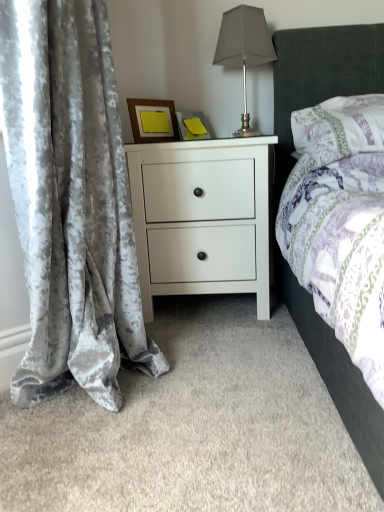
Question: From their relative heights in the image, would you say white matte nightstand at center is taller or shorter than velvet gray curtain at left?

Choices:
 (A) tall
 (B) short

Answer: (B)

Question: Looking at the image, does white matte nightstand at center seem bigger or smaller compared to velvet gray curtain at left?

Choices:
 (A) big
 (B) small

Answer: (B)

Question: Estimate the real-world distances between objects in this image. Which object is farther from the satin silver table lamp at upper right?

Choices:
 (A) white matte nightstand at center
 (B) patterned fabric pillow at upper right
 (C) wooden frame at upper center
 (D) velvet gray curtain at left

Answer: (D)

Question: Which object is positioned closest to the satin silver table lamp at upper right?

Choices:
 (A) wooden frame at upper center
 (B) white matte nightstand at center
 (C) patterned fabric pillow at upper right
 (D) velvet gray curtain at left

Answer: (A)